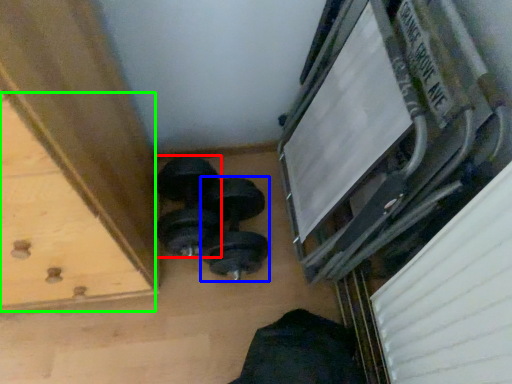
Question: Considering the real-world distances, which object is farthest from dumbbell (highlighted by a red box)? dumbbell (highlighted by a blue box) or drawer (highlighted by a green box)?

Choices:
 (A) dumbbell
 (B) drawer

Answer: (B)